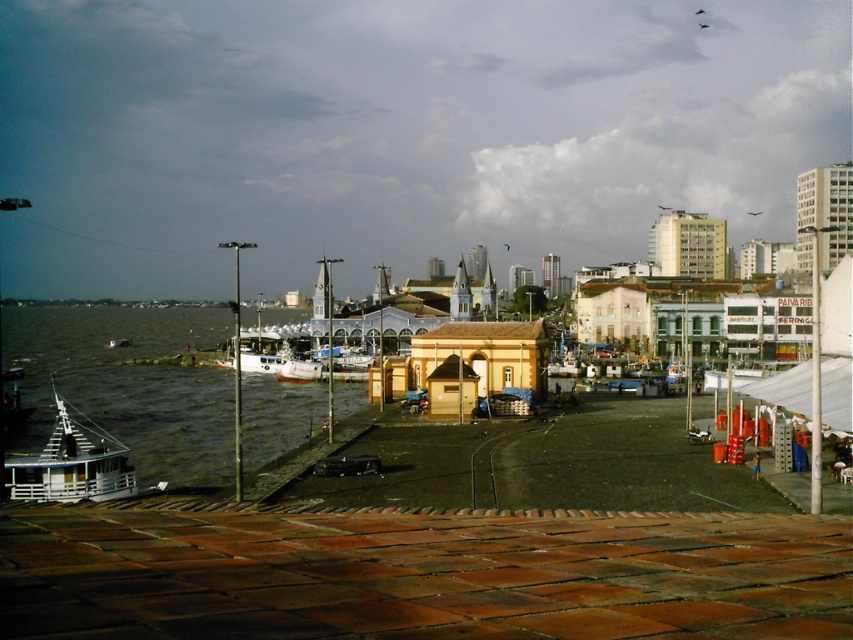
Who is lower down, brown wooden dock at lower center or greenish water at lower left?

brown wooden dock at lower center is below.

Is brown wooden dock at lower center positioned in front of greenish water at lower left?

Yes, brown wooden dock at lower center is closer to the viewer.

Between point (775, 589) and point (167, 412), which one is positioned behind?

The point (167, 412) is behind.

Find the location of a particular element. brown wooden dock at lower center is located at coordinates (419, 573).

Is brown wooden dock at lower center bigger than white wooden boat at lower left?

Actually, brown wooden dock at lower center might be smaller than white wooden boat at lower left.

Is point (146, 577) behind point (38, 477)?

No, it is not.

The height and width of the screenshot is (640, 853). Identify the location of brown wooden dock at lower center. (419, 573).

Which is behind, point (102, 316) or point (67, 472)?

The point (102, 316) is more distant.

Is point (136, 456) positioned after point (61, 428)?

Yes, point (136, 456) is behind point (61, 428).

Where is `greenish water at lower left`? The height and width of the screenshot is (640, 853). greenish water at lower left is located at coordinates (129, 385).